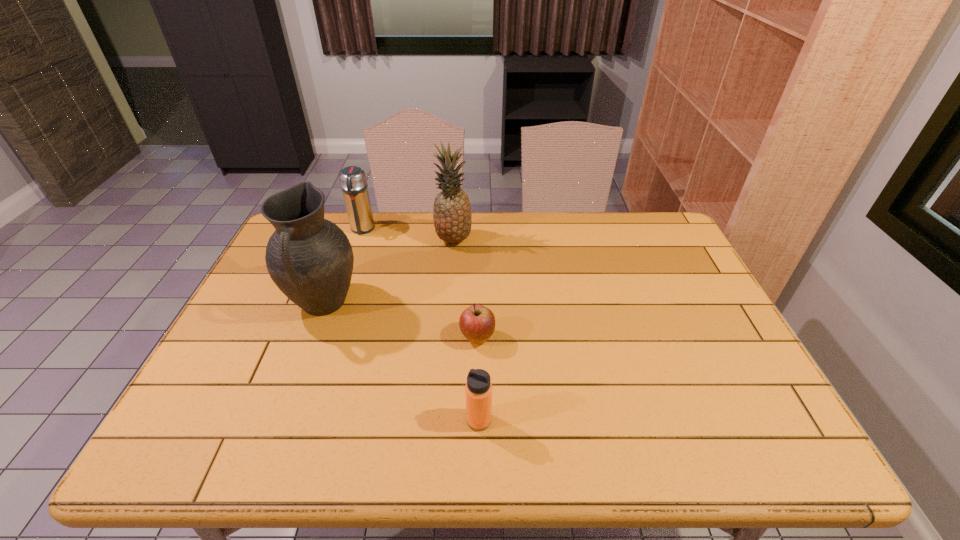
This screenshot has width=960, height=540. What are the coordinates of `vacant area between the farther thermos bottle and the nearer thermos bottle` in the screenshot? It's located at (420, 325).

What are the coordinates of `vacant area that lies between the nearest object and the taller thermos bottle` in the screenshot? It's located at (420, 325).

Locate an element on the screen. This screenshot has width=960, height=540. empty location between the apple and the pineapple is located at coordinates (466, 289).

This screenshot has height=540, width=960. What are the coordinates of `free area in between the shortest object and the left thermos bottle` in the screenshot? It's located at (420, 284).

Locate an element on the screen. The width and height of the screenshot is (960, 540). free space between the shortest object and the left thermos bottle is located at coordinates (420, 284).

Identify the location of blank region between the shortest object and the pineapple. Image resolution: width=960 pixels, height=540 pixels. (466, 289).

The image size is (960, 540). What are the coordinates of `vacant space that's between the pineapple and the pitcher` in the screenshot? It's located at [x=389, y=272].

Identify the location of vacant area that lies between the pineapple and the farther thermos bottle. (408, 234).

You are a GUI agent. You are given a task and a screenshot of the screen. Output one action in this format:
    pyautogui.click(x=<x>, y=<y>)
    Task: Click on the free point between the right thermos bottle and the farther thermos bottle
    The height and width of the screenshot is (540, 960).
    Given the screenshot: What is the action you would take?
    pyautogui.click(x=420, y=325)

The image size is (960, 540). In order to click on free point between the third tallest object and the pineapple in this screenshot , I will do `click(408, 234)`.